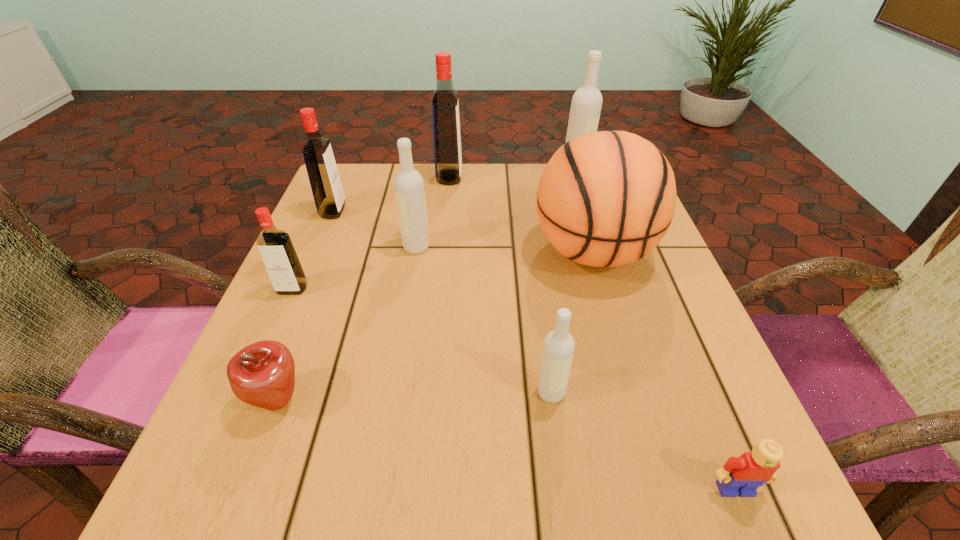
Point out which vodka is positioned as the third nearest to the smallest white vodka. Please provide its 2D coordinates. Your answer should be formatted as a tuple, i.e. [(x, y)], where the tuple contains the x and y coordinates of a point satisfying the conditions above.

[(445, 107)]

Select which red vodka is the closest to the second nearest vodka. Please provide its 2D coordinates. Your answer should be formatted as a tuple, i.e. [(x, y)], where the tuple contains the x and y coordinates of a point satisfying the conditions above.

[(327, 190)]

Select which red vodka appears as the second closest to the fourth nearest vodka. Please provide its 2D coordinates. Your answer should be formatted as a tuple, i.e. [(x, y)], where the tuple contains the x and y coordinates of a point satisfying the conditions above.

[(445, 107)]

The image size is (960, 540). I want to click on white vodka identified as the closest to the third farthest vodka, so click(x=408, y=183).

At what (x,y) coordinates should I click in order to perform the action: click on white vodka identified as the second closest to the rightmost red vodka. Please return your answer as a coordinate pair (x, y). This screenshot has width=960, height=540. Looking at the image, I should click on pos(586,104).

Where is `free spot that satisfies the following two spatial constraints: 1. on the front and back of the rightmost red vodka; 2. on the left side of the smallest white vodka`? The width and height of the screenshot is (960, 540). free spot that satisfies the following two spatial constraints: 1. on the front and back of the rightmost red vodka; 2. on the left side of the smallest white vodka is located at coordinates (428, 393).

Image resolution: width=960 pixels, height=540 pixels. What are the coordinates of `vacant region that satisfies the following two spatial constraints: 1. on the front and back of the second vodka from right to left; 2. on the left side of the second biggest red vodka` in the screenshot? It's located at (256, 393).

This screenshot has width=960, height=540. What are the coordinates of `vacant area in the image that satisfies the following two spatial constraints: 1. on the front and back of the fourth nearest vodka; 2. on the front and back of the smallest red vodka` in the screenshot? It's located at (300, 289).